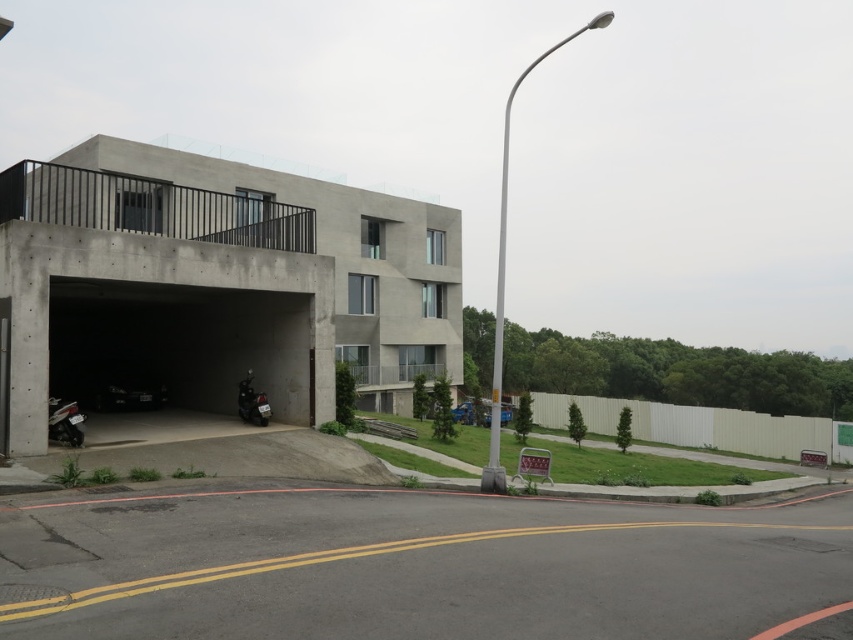
Question: Is concrete parking garage at left positioned in front of shiny black motorcycle at lower left?

Choices:
 (A) yes
 (B) no

Answer: (A)

Question: Which object is the closest to the shiny black motorcycle at lower left?

Choices:
 (A) shiny black motorcycle at center-left
 (B) concrete parking garage at left

Answer: (A)

Question: Which object is closer to the camera taking this photo?

Choices:
 (A) shiny black motorcycle at center-left
 (B) shiny black motorcycle at lower left

Answer: (B)

Question: Is shiny black motorcycle at lower left positioned at the back of shiny black motorcycle at center-left?

Choices:
 (A) no
 (B) yes

Answer: (A)

Question: Is concrete parking garage at left to the left of shiny black motorcycle at lower left from the viewer's perspective?

Choices:
 (A) yes
 (B) no

Answer: (A)

Question: Which of the following is the closest to the observer?

Choices:
 (A) shiny black motorcycle at lower left
 (B) shiny black motorcycle at center-left

Answer: (A)